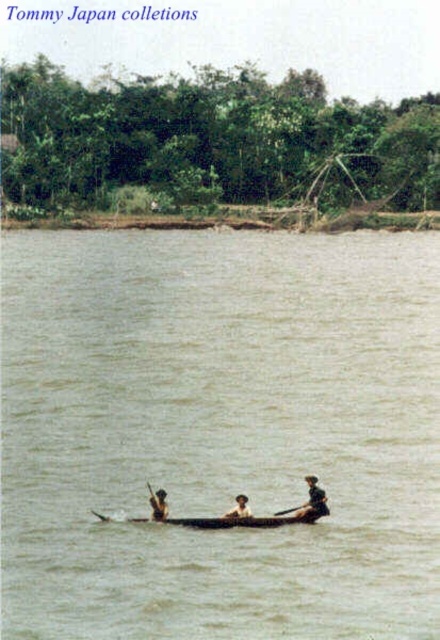
Question: Considering the relative positions of brown wooden canoe at center and wooden paddle at center in the image provided, where is brown wooden canoe at center located with respect to wooden paddle at center?

Choices:
 (A) above
 (B) below

Answer: (A)

Question: Does brown wooden canoe at center appear under brown wooden boat at center?

Choices:
 (A) no
 (B) yes

Answer: (A)

Question: Which of these objects is positioned closest to the brown leather boat at center?

Choices:
 (A) brown wooden boat at center
 (B) wooden paddle at center
 (C) brown wooden canoe at center
 (D) dark brown wooden paddle at center

Answer: (A)

Question: Which point is farther to the camera?

Choices:
 (A) wooden paddle at center
 (B) brown wooden boat at center
 (C) brown leather boat at center

Answer: (A)

Question: Is brown wooden boat at center positioned behind wooden paddle at center?

Choices:
 (A) no
 (B) yes

Answer: (A)

Question: Which is farther from the wooden paddle at center?

Choices:
 (A) brown leather boat at center
 (B) brown wooden boat at center
 (C) dark brown wooden paddle at center
 (D) brown wooden canoe at center

Answer: (D)